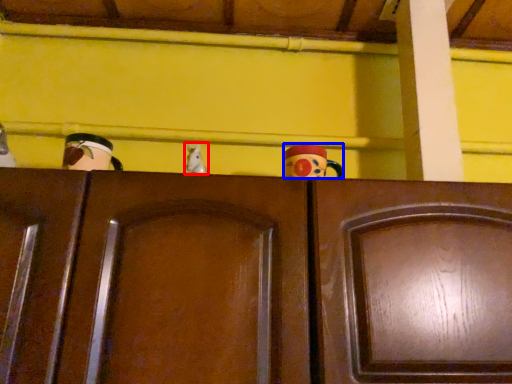
Question: Which point is further to the camera, toy (highlighted by a red box) or toy (highlighted by a blue box)?

Choices:
 (A) toy
 (B) toy

Answer: (B)